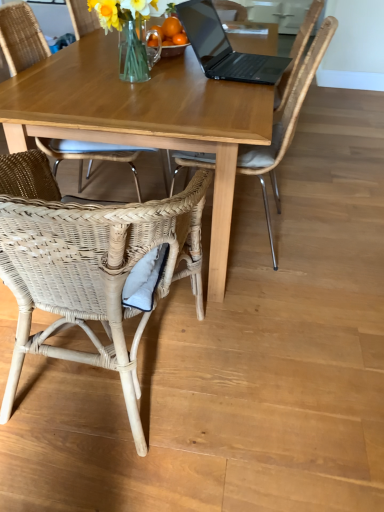
Find the location of `vacant area that is in front of black matte laptop at upper center`. vacant area that is in front of black matte laptop at upper center is located at coordinates (206, 99).